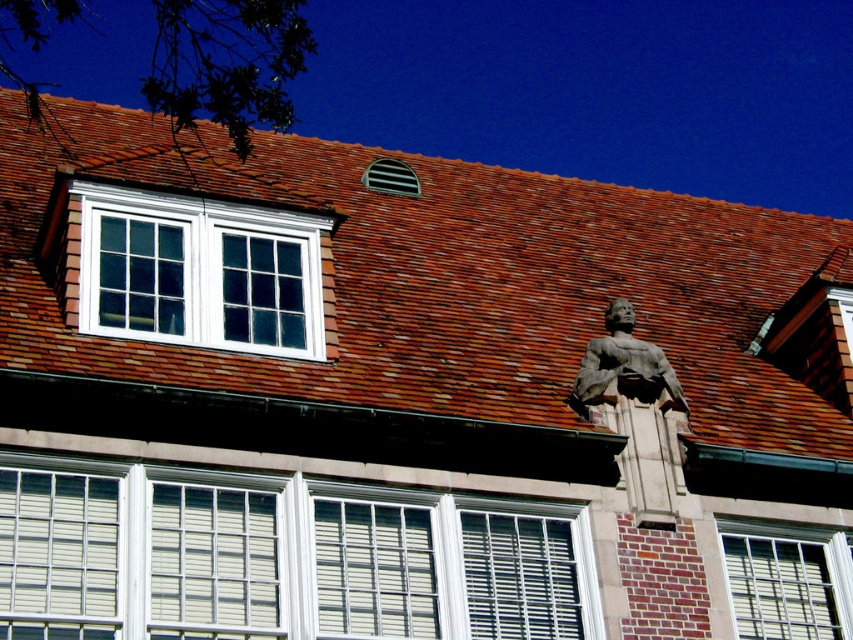
You are an architect analyzing the building facade. You need to determine which object occupies more space in the image between the brown tile roof at upper center and the white textured window at lower right. Based on the description, which one is larger?

The brown tile roof at upper center has a larger size compared to the white textured window at lower right, so the brown tile roof at upper center occupies more space in the image.

You are standing in front of the building and want to take a photo of the white glass window at upper center. If your camera can focus on objects up to 50 meters away, will it be able to capture the window clearly?

The white glass window at upper center is 46.90 meters away from the camera. Since the camera can focus up to 50 meters, it will be able to capture the window clearly as the distance is within the focus range.

You are standing 10 meters away from the building. You want to throw a small ball to hit the white glass window at upper center but avoid hitting the white textured shutters at center. Can you do it? Explain why.

The white glass window at upper center is 8.95 meters away from the white textured shutters at center. Since you are 10 meters away from the building, the distance between you and the window is less than your distance from the building. Therefore, you can aim for the window while keeping a safe distance from the shutters.